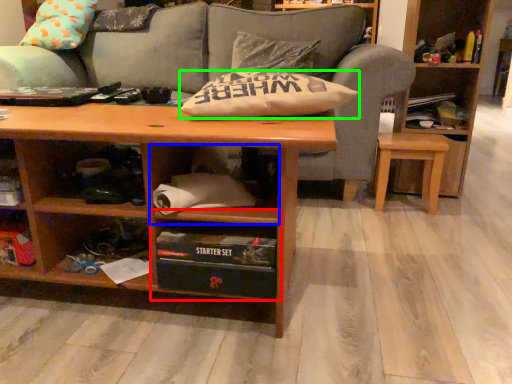
Question: Considering the real-world distances, which object is farthest from cabinet (highlighted by a red box)? cabinet (highlighted by a blue box) or pillow (highlighted by a green box)?

Choices:
 (A) cabinet
 (B) pillow

Answer: (B)